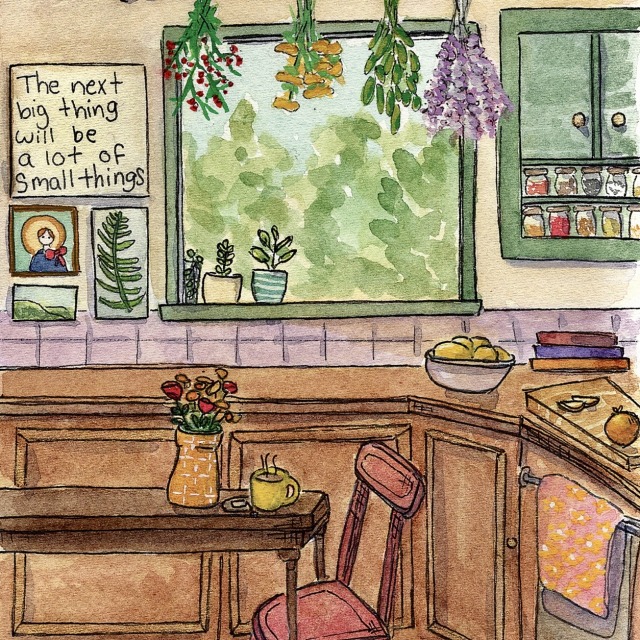
This screenshot has height=640, width=640. What are the coordinates of `counter` in the screenshot? It's located at (355, 372), (137, 377).